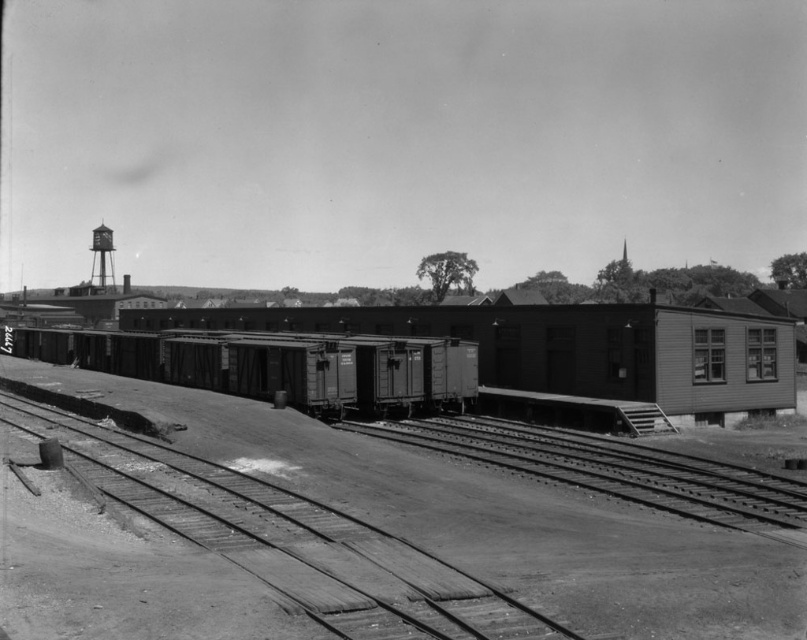
Question: Is smooth wood train track at lower left below smooth metal water tower at upper left?

Choices:
 (A) yes
 (B) no

Answer: (A)

Question: Which object appears closest to the camera in this image?

Choices:
 (A) smooth metal water tower at upper left
 (B) smooth metal train car at center
 (C) smooth wood train track at lower left
 (D) smooth metal track at center

Answer: (C)

Question: Does smooth wood train track at lower left have a greater width compared to smooth metal water tower at upper left?

Choices:
 (A) no
 (B) yes

Answer: (A)

Question: Where is smooth metal train car at center located in relation to smooth metal track at center in the image?

Choices:
 (A) above
 (B) below

Answer: (A)

Question: Which object appears closest to the camera in this image?

Choices:
 (A) smooth metal train car at center
 (B) smooth metal track at center

Answer: (B)

Question: Which of these objects is positioned closest to the smooth metal train car at center?

Choices:
 (A) smooth metal water tower at upper left
 (B) smooth wood train track at lower left
 (C) smooth metal track at center

Answer: (C)